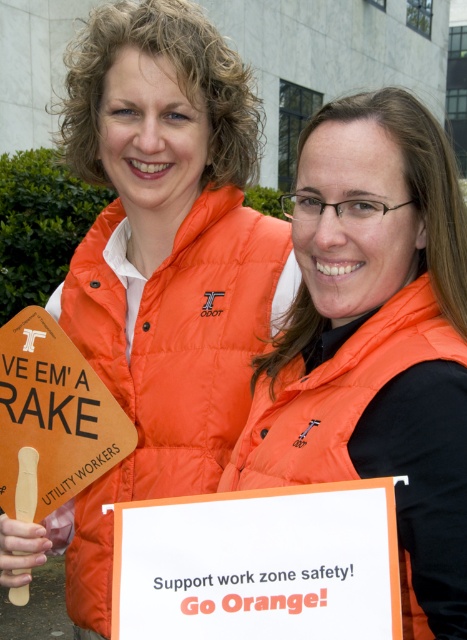
Is orange puffy vest at upper center bigger than white paper sign at center?

Correct, orange puffy vest at upper center is larger in size than white paper sign at center.

Is orange puffy vest at upper center thinner than white paper sign at center?

In fact, orange puffy vest at upper center might be wider than white paper sign at center.

Which is behind, point (242, 364) or point (142, 518)?

Point (242, 364)

Where is `orange puffy vest at upper center`? orange puffy vest at upper center is located at coordinates (169, 364).

Is white paper sign at center shorter than orange puffy vest at center?

Yes.

Looking at this image, who is lower down, white paper sign at center or orange puffy vest at center?

white paper sign at center

Is point (181, 561) positioned after point (282, 428)?

No, it is in front of (282, 428).

Image resolution: width=467 pixels, height=640 pixels. Identify the location of white paper sign at center. (259, 564).

Can you confirm if white paper sign at center is positioned below woodensign at left?

Correct, white paper sign at center is located below woodensign at left.

Is point (267, 582) in front of point (99, 397)?

Yes.

Is point (316, 554) positioned after point (84, 483)?

No.

Identify the location of white paper sign at center. The width and height of the screenshot is (467, 640). (259, 564).